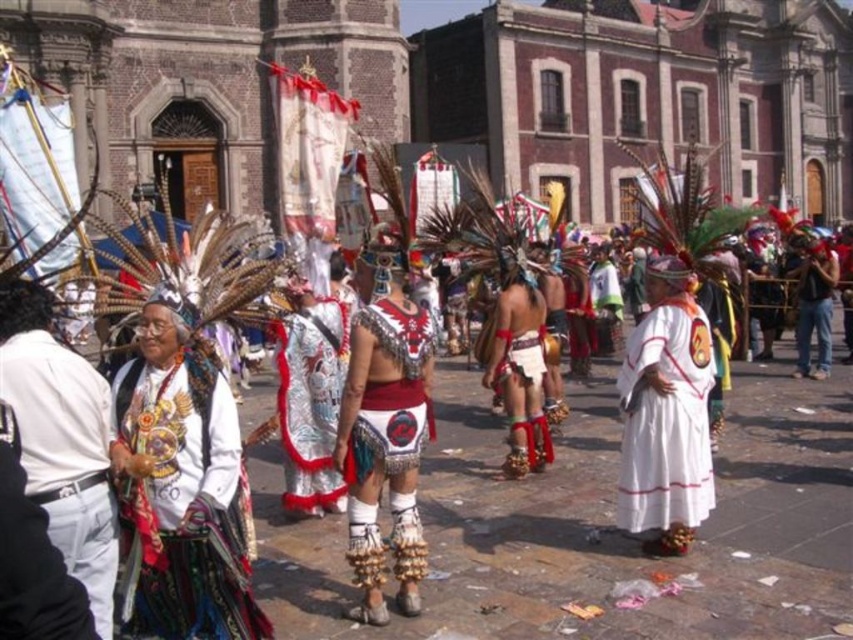
Does embroidered velvet dress at center come behind white cotton dress at center?

No, embroidered velvet dress at center is closer to the viewer.

Does embroidered velvet dress at center appear on the right side of white cotton dress at center?

In fact, embroidered velvet dress at center is to the left of white cotton dress at center.

Describe the element at coordinates (184, 509) in the screenshot. I see `embroidered velvet dress at center` at that location.

Find the location of `embroidered velvet dress at center`. embroidered velvet dress at center is located at coordinates (184, 509).

The image size is (853, 640). I want to click on white cotton shirt at center, so click(x=61, y=440).

Between white cotton shirt at center and white cotton dress at center, which one is positioned lower?

white cotton dress at center

Is point (96, 481) positioned in front of point (651, 490)?

Yes, point (96, 481) is in front of point (651, 490).

At what (x,y) coordinates should I click in order to perform the action: click on white cotton shirt at center. Please return your answer as a coordinate pair (x, y). This screenshot has height=640, width=853. Looking at the image, I should click on (61, 440).

Between embroidered velvet dress at center and silver metallic armor at center, which one has more height?

With more height is embroidered velvet dress at center.

What do you see at coordinates (184, 509) in the screenshot? I see `embroidered velvet dress at center` at bounding box center [184, 509].

Does point (138, 403) lie in front of point (370, 428)?

That is True.

Image resolution: width=853 pixels, height=640 pixels. I want to click on embroidered velvet dress at center, so click(x=184, y=509).